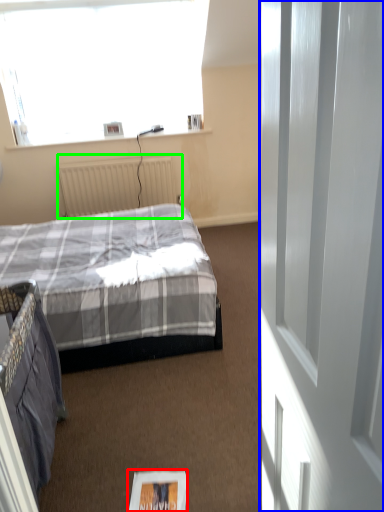
Question: Which is nearer to the magazine (highlighted by a red box)? screen door (highlighted by a blue box) or radiator (highlighted by a green box).

Choices:
 (A) screen door
 (B) radiator

Answer: (A)